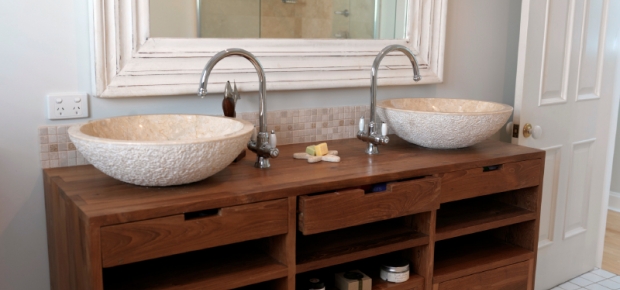
Where is `silver lid on small white jar`? Image resolution: width=620 pixels, height=290 pixels. silver lid on small white jar is located at coordinates pos(396,266).